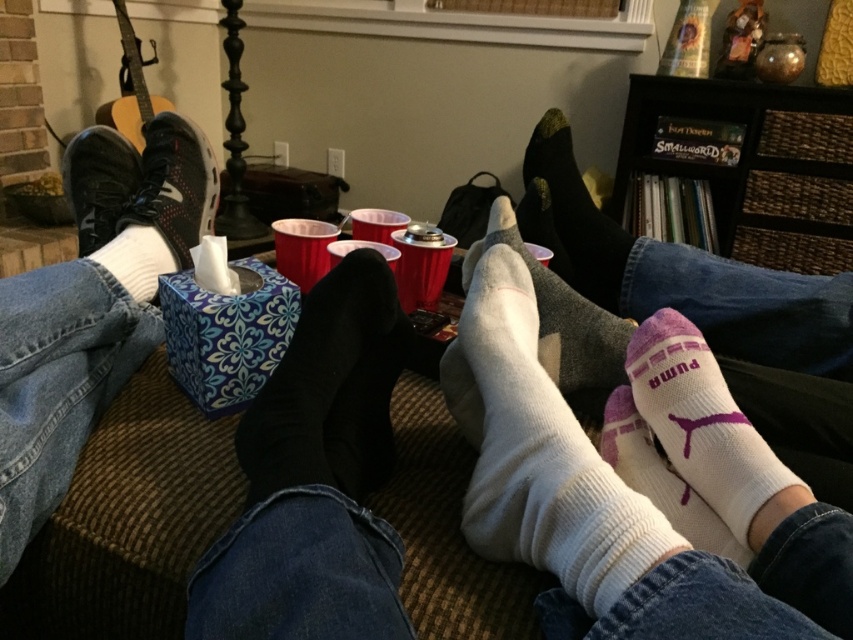
The height and width of the screenshot is (640, 853). What do you see at coordinates (544, 456) in the screenshot?
I see `white ribbed sock at lower center` at bounding box center [544, 456].

Consider the image. Can you confirm if white ribbed sock at lower center is taller than matte black sneaker at left?

In fact, white ribbed sock at lower center may be shorter than matte black sneaker at left.

What do you see at coordinates (544, 456) in the screenshot?
I see `white ribbed sock at lower center` at bounding box center [544, 456].

Identify the location of white ribbed sock at lower center. The image size is (853, 640). (544, 456).

Is white cotton socks at lower right behind white soft socks at lower left?

No, it is in front of white soft socks at lower left.

At what (x,y) coordinates should I click in order to perform the action: click on white cotton socks at lower right. Please return your answer as a coordinate pair (x, y). This screenshot has width=853, height=640. Looking at the image, I should click on (708, 429).

Where is `white cotton socks at lower right`? The height and width of the screenshot is (640, 853). white cotton socks at lower right is located at coordinates (708, 429).

Does white textured sock at lower right appear on the left side of white soft socks at lower left?

Incorrect, white textured sock at lower right is not on the left side of white soft socks at lower left.

Does white textured sock at lower right have a lesser width compared to white soft socks at lower left?

Incorrect, white textured sock at lower right's width is not less than white soft socks at lower left's.

Between point (704, 540) and point (129, 273), which one is positioned behind?

Positioned behind is point (129, 273).

Identify the location of white textured sock at lower right. (660, 477).